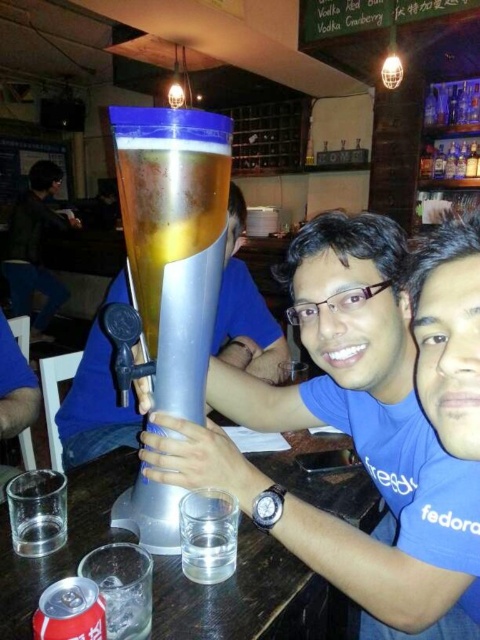
You are a customer at the bar and want to grab the silver metallic beer at center. The bartender tells you to reach past the matte silver beer tap at center. Is this the correct direction?

Yes, because the silver metallic beer at center is located to the right of the matte silver beer tap at center, so you would need to reach past it to the right to grab the beer.

You are a bartender who needs to place a new drink order. You see the silver metallic beer at center and the matte black shirt at upper left. Which item is shorter in height?

The silver metallic beer at center is not as tall as matte black shirt at upper left, so the silver metallic beer at center is shorter in height.